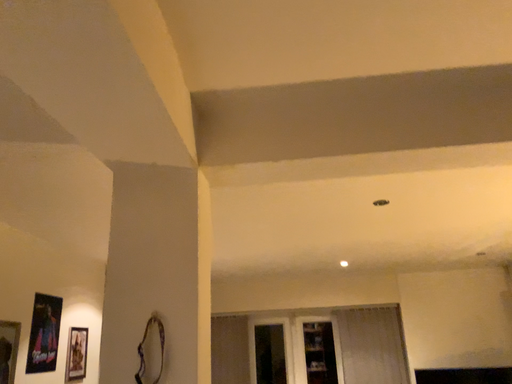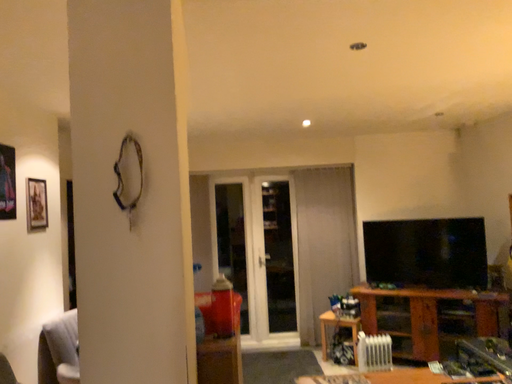
Question: Which way did the camera rotate in the video?

Choices:
 (A) rotated downward
 (B) rotated upward

Answer: (A)